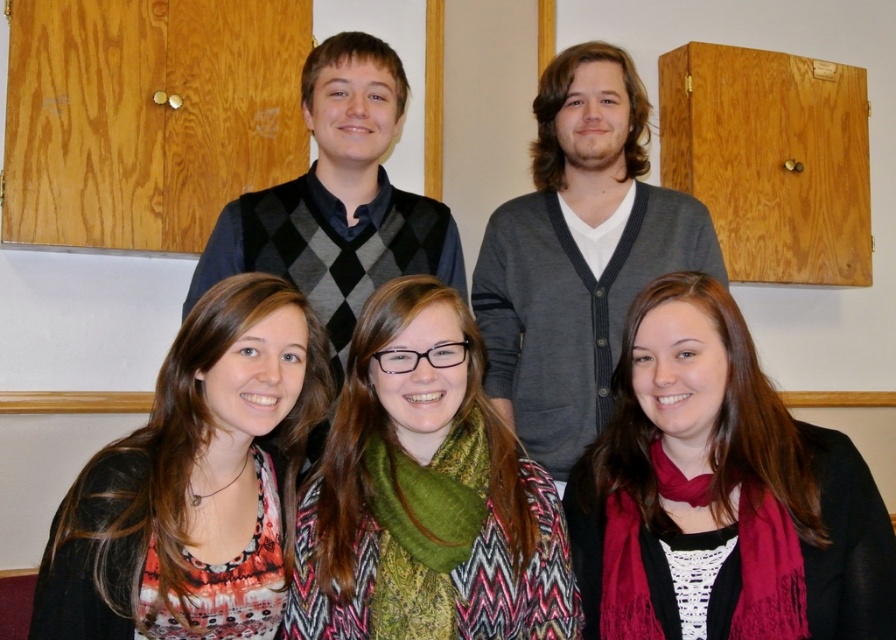
You are planning to take a photo of the scene. You want to ensure both the matte black jacket at lower right and the gray cardigan at upper center are visible. Based on their positions, which object should you focus on first to ensure both are in frame?

The matte black jacket at lower right is located below the gray cardigan at upper center. To ensure both are in frame, focus on the gray cardigan at upper center first as it is higher up, allowing the camera to capture the lower positioned matte black jacket at lower right within the same shot.

You are standing in the community center and want to locate two specific points in the image. The first point is at coordinate point (764, 522) and the second is at point (336, 444). Which of these two points is closer to you?

Point (764, 522) is closer to the viewer than point (336, 444).